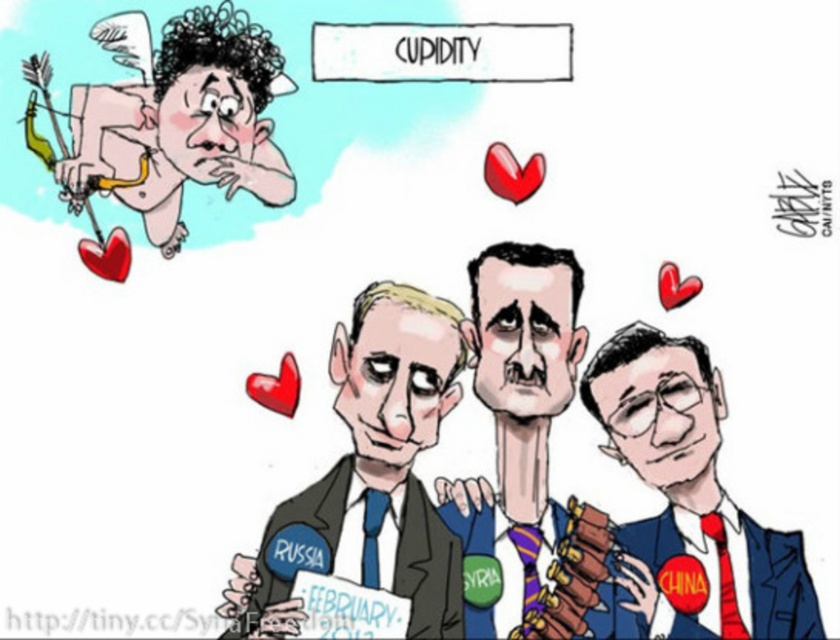
Can you confirm if smooth blue suit at center is shorter than blue suit at lower right?

No, smooth blue suit at center is not shorter than blue suit at lower right.

Does point (329, 525) come in front of point (709, 540)?

That is False.

Where is `smooth blue suit at center`? The width and height of the screenshot is (840, 640). smooth blue suit at center is located at coordinates (379, 468).

Who is more forward, (132, 173) or (489, 330)?

Positioned in front is point (132, 173).

Who is more forward, (113, 140) or (554, 365)?

Point (113, 140) is more forward.

Identify the location of matte pink heart at upper left. (177, 118).

What do you see at coordinates (379, 468) in the screenshot? The image size is (840, 640). I see `smooth blue suit at center` at bounding box center [379, 468].

Who is more distant from viewer, (348, 481) or (177, 147)?

The point (348, 481) is more distant.

Where is `smooth blue suit at center`? smooth blue suit at center is located at coordinates (379, 468).

Identify the location of smooth blue suit at center. The height and width of the screenshot is (640, 840). (379, 468).